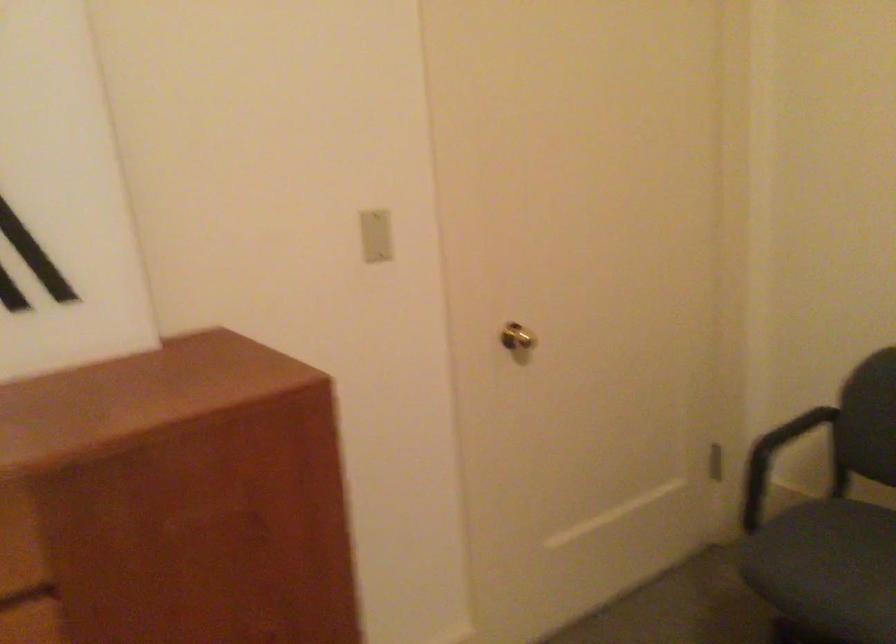
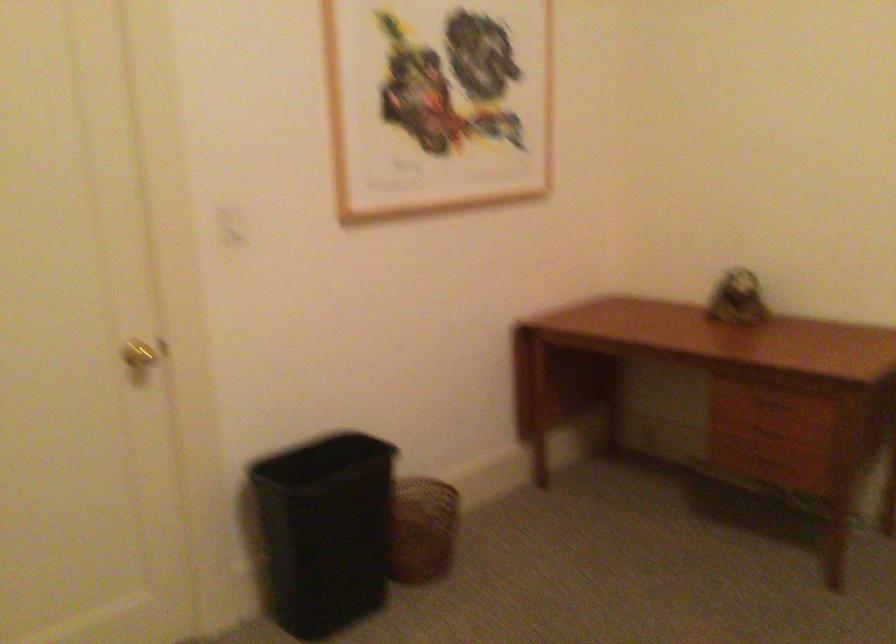
Question: The camera is either moving clockwise (left) or counter-clockwise (right) around the object. The first image is from the beginning of the video and the second image is from the end. Is the camera moving left or right when shooting the video?

Choices:
 (A) Left
 (B) Right

Answer: (A)